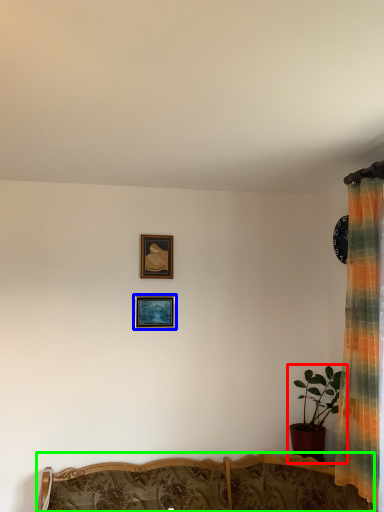
Question: Estimate the real-world distances between objects in this image. Which object is farther from houseplant (highlighted by a red box), picture frame (highlighted by a blue box) or furniture (highlighted by a green box)?

Choices:
 (A) picture frame
 (B) furniture

Answer: (A)